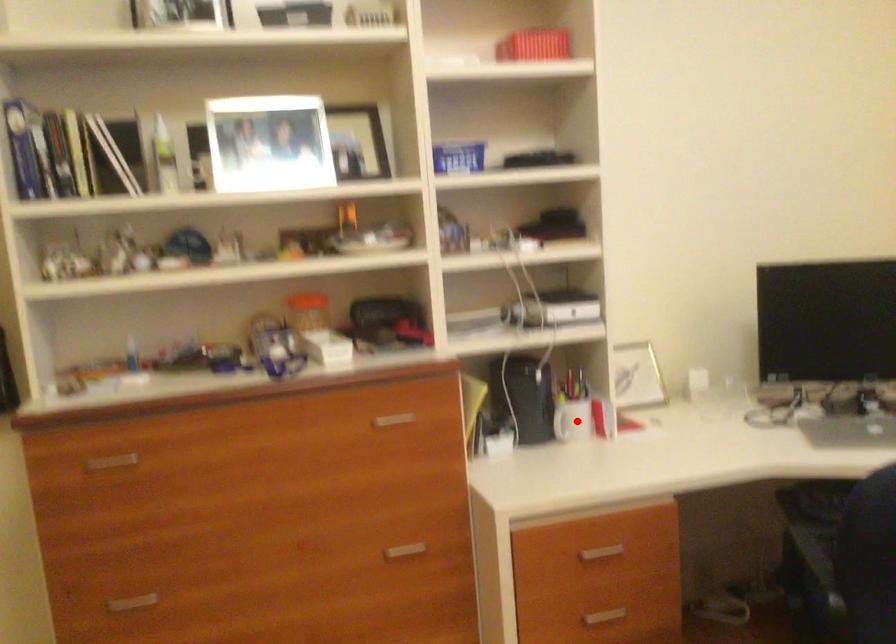
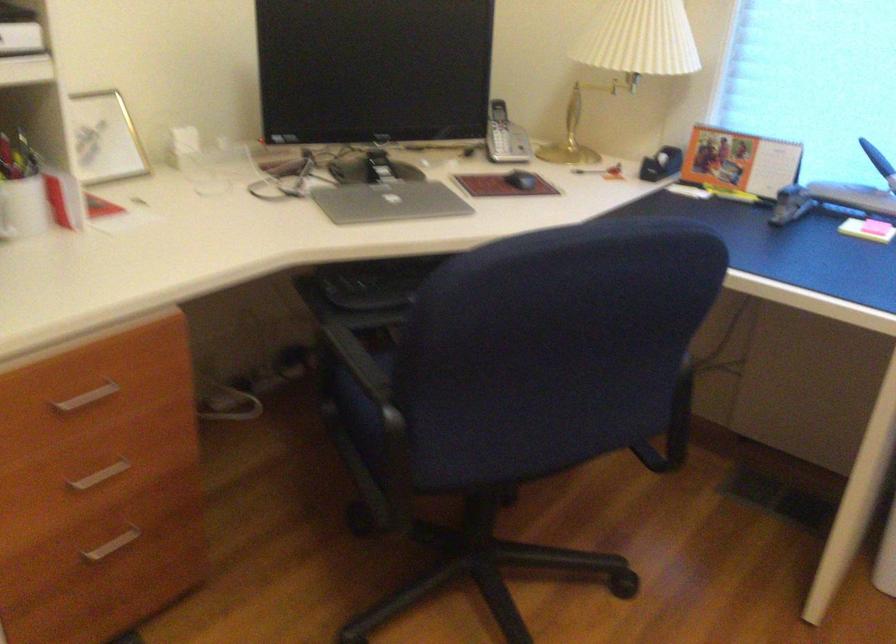
Question: I am providing you with two images of the same scene from different viewpoints. Image1 has a red point marked. In image2, the corresponding 3D location appears at what relative position? Reply with the corresponding letter.

Choices:
 (A) Closer
 (B) Farther

Answer: (A)